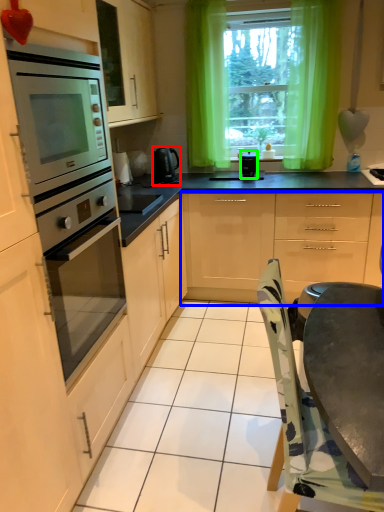
Question: Which is farther away from home appliance (highlighted by a red box)? cabinetry (highlighted by a blue box) or kitchen appliance (highlighted by a green box)?

Choices:
 (A) cabinetry
 (B) kitchen appliance

Answer: (A)